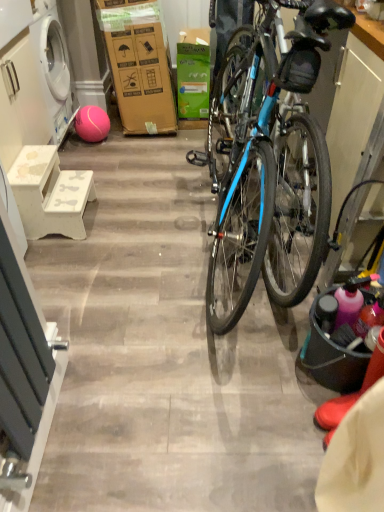
Question: Considering the relative sizes of white matte stool at left and matte black bucket at right in the image provided, is white matte stool at left smaller than matte black bucket at right?

Choices:
 (A) yes
 (B) no

Answer: (B)

Question: Can you confirm if white matte stool at left is wider than matte black bucket at right?

Choices:
 (A) yes
 (B) no

Answer: (A)

Question: Is white matte stool at left positioned beyond the bounds of matte black bucket at right?

Choices:
 (A) yes
 (B) no

Answer: (A)

Question: Is white matte stool at left shorter than matte black bucket at right?

Choices:
 (A) no
 (B) yes

Answer: (B)

Question: Is there a large distance between white matte stool at left and matte black bucket at right?

Choices:
 (A) no
 (B) yes

Answer: (B)

Question: Looking at their shapes, would you say matte black bucket at right is wider or thinner than white matte stool at left?

Choices:
 (A) wide
 (B) thin

Answer: (B)

Question: From a real-world perspective, is matte black bucket at right physically located above or below white matte stool at left?

Choices:
 (A) above
 (B) below

Answer: (A)

Question: Considering their positions, is matte black bucket at right located in front of or behind white matte stool at left?

Choices:
 (A) front
 (B) behind

Answer: (A)

Question: Considering the positions of matte black bucket at right and white matte stool at left in the image, is matte black bucket at right taller or shorter than white matte stool at left?

Choices:
 (A) short
 (B) tall

Answer: (B)

Question: Do you think white wood cabinet at left is within green cardboard box at center, or outside of it?

Choices:
 (A) inside
 (B) outside

Answer: (B)

Question: In terms of size, does white wood cabinet at left appear bigger or smaller than green cardboard box at center?

Choices:
 (A) big
 (B) small

Answer: (A)

Question: From a real-world perspective, is white wood cabinet at left positioned above or below green cardboard box at center?

Choices:
 (A) above
 (B) below

Answer: (A)

Question: Considering the positions of point (1, 9) and point (188, 94), is point (1, 9) closer or farther from the camera than point (188, 94)?

Choices:
 (A) farther
 (B) closer

Answer: (B)

Question: Considering the positions of pink rubber ball at lower left and white wood cabinet at left in the image, is pink rubber ball at lower left wider or thinner than white wood cabinet at left?

Choices:
 (A) thin
 (B) wide

Answer: (A)

Question: In terms of height, does pink rubber ball at lower left look taller or shorter compared to white wood cabinet at left?

Choices:
 (A) tall
 (B) short

Answer: (B)